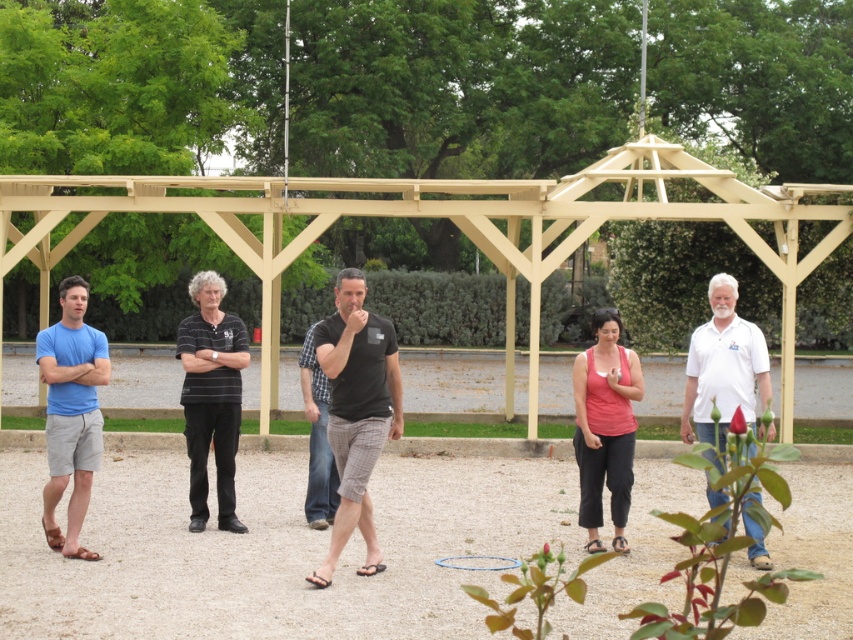
Question: Is black striped shirt at center below pink fabric tank top at center?

Choices:
 (A) no
 (B) yes

Answer: (B)

Question: From the image, what is the correct spatial relationship of blue cotton t-shirt at left in relation to white cotton shirt at right?

Choices:
 (A) right
 (B) left

Answer: (B)

Question: Can you confirm if black striped shirt at center is wider than pink fabric tank top at center?

Choices:
 (A) yes
 (B) no

Answer: (A)

Question: Which point is closer to the camera?

Choices:
 (A) (62, 388)
 (B) (357, 449)
 (C) (752, 328)
 (D) (610, 508)

Answer: (B)

Question: Which point appears closest to the camera in this image?

Choices:
 (A) (198, 392)
 (B) (50, 445)

Answer: (B)

Question: Which point is farther to the camera?

Choices:
 (A) pink fabric tank top at center
 (B) black cotton shirt at center
 (C) blue cotton t-shirt at left

Answer: (B)